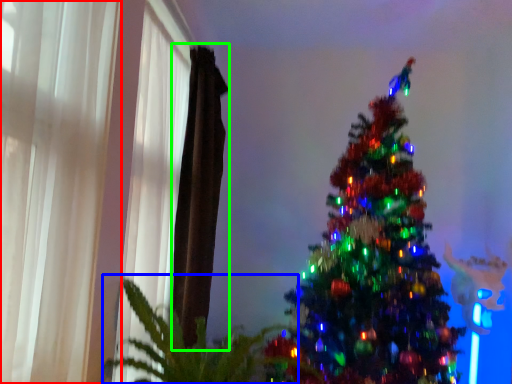
Question: Based on their relative distances, which object is nearer to curtain (highlighted by a red box)? Choose from plant (highlighted by a blue box) and curtain (highlighted by a green box).

Choices:
 (A) plant
 (B) curtain

Answer: (A)